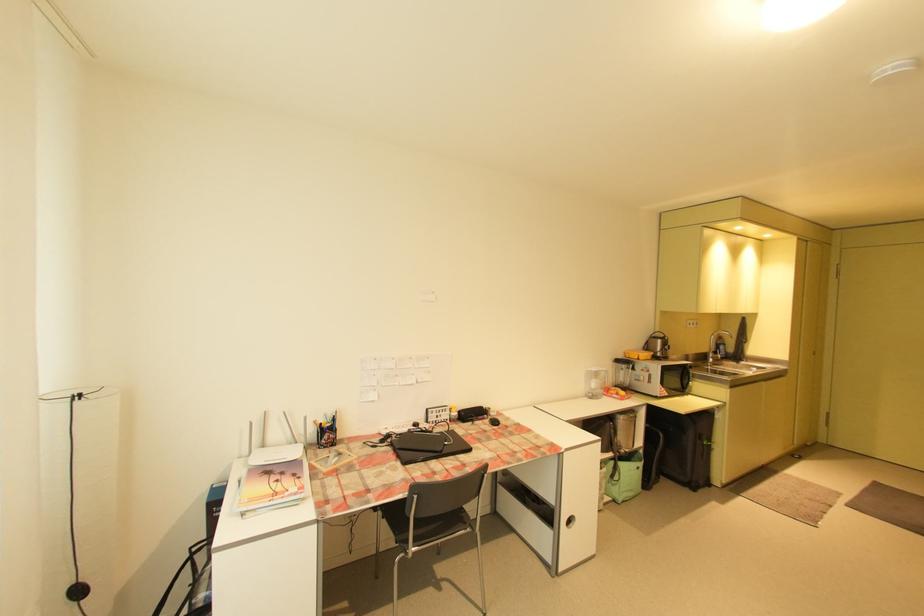
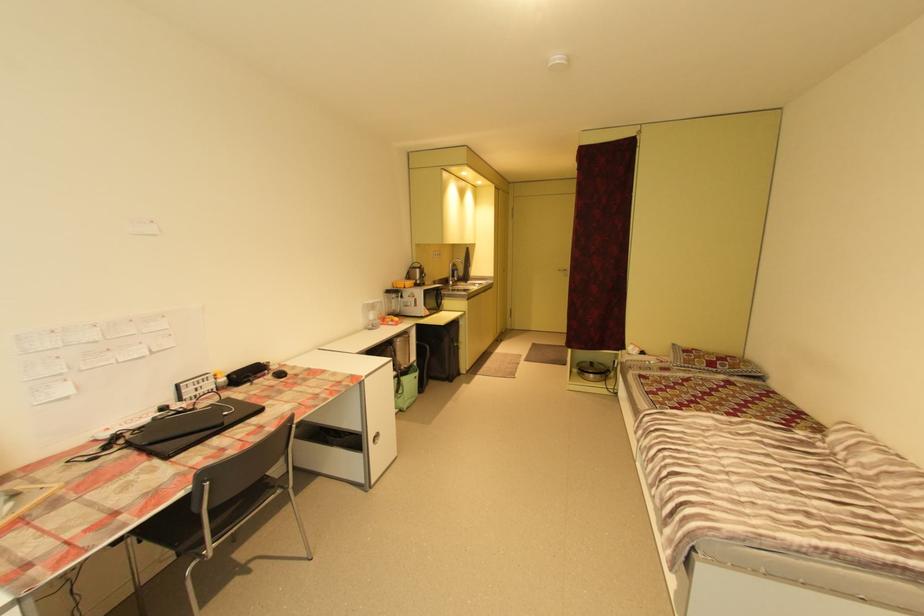
In the second image, find the point that corresponds to (598,371) in the first image.

(374, 304)